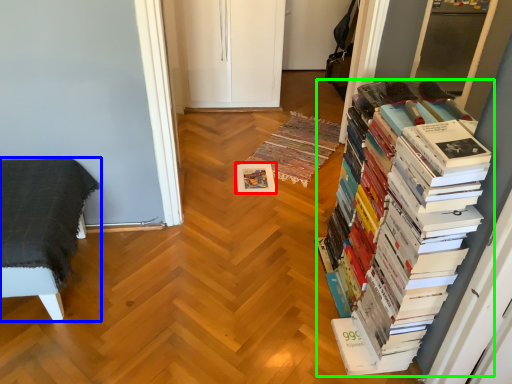
Question: Estimate the real-world distances between objects in this image. Which object is farther from paperback book (highlighted by a red box), furniture (highlighted by a blue box) or book (highlighted by a green box)?

Choices:
 (A) furniture
 (B) book

Answer: (B)